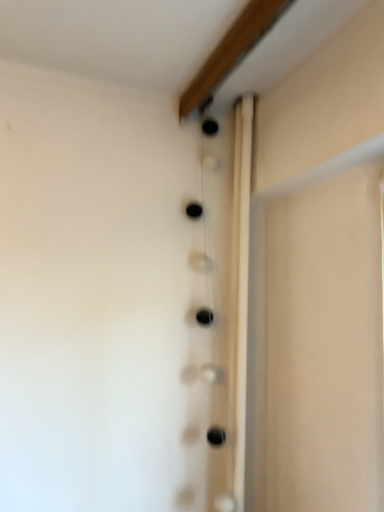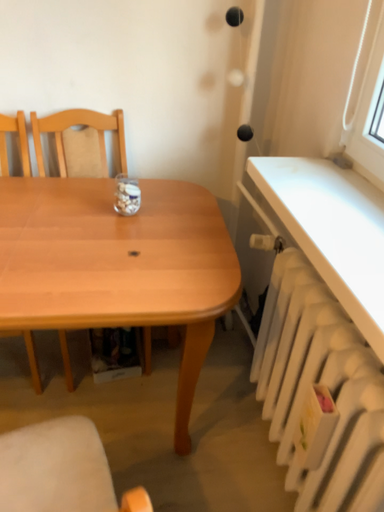
Question: Which way did the camera rotate in the video?

Choices:
 (A) rotated downward
 (B) rotated upward

Answer: (A)